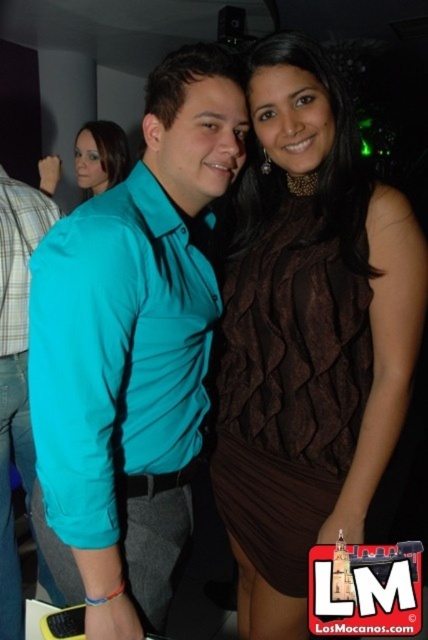
You are a photographer at the party and need to adjust the camera focus. The two subjects are wearing the brown textured dress at center and the matte teal shirt at center. Which one is closer to the camera?

The brown textured dress at center is 28.29 inches from the matte teal shirt at center, so the brown textured dress at center is closer to the camera than the matte teal shirt at center.

You are at a party and want to take a photo with the person wearing the matte teal shirt at center. Where should you position yourself relative to them to ensure they are in the frame?

The matte teal shirt at center is located at point (15, 374), so you should position yourself slightly to the right and lower down to ensure they are centered in your photo.

You are at a party and want to take a photo with both the matte teal shirt at center and the matte teal blouse at upper left in the frame. Which one should you focus on first to ensure both are in the shot?

You should focus on the matte teal blouse at upper left first because the matte teal shirt at center is positioned under it, so adjusting the camera angle to include the blouse will naturally include the shirt as well.